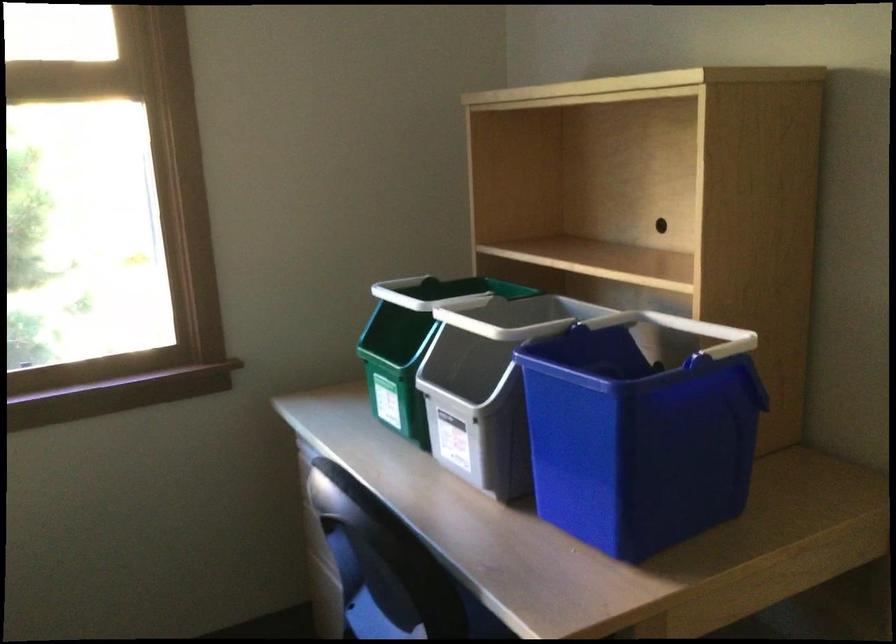
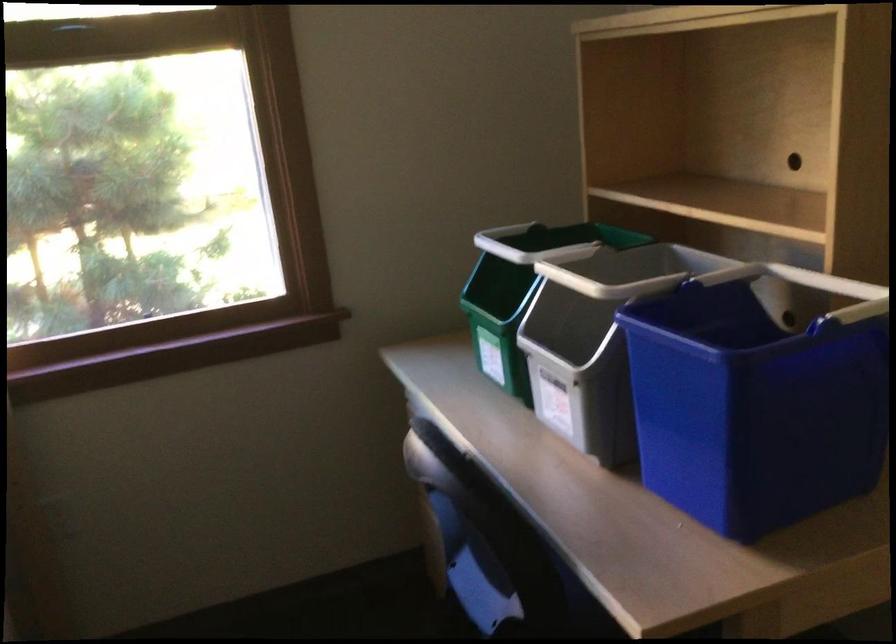
The images are taken continuously from a first-person perspective. In which direction are you moving?

The cameraman walked toward right, forward.